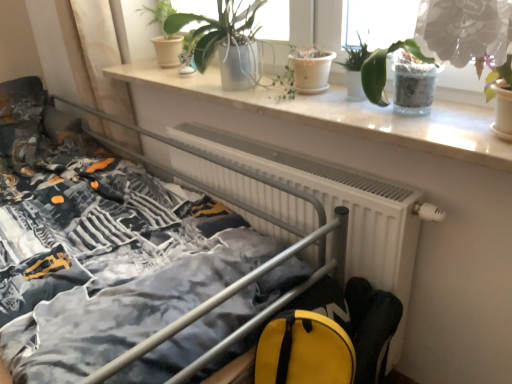
Question: Is metallic gray bed at center next to green glossy plant at upper right, which appears as the first houseplant when viewed from the right, and touching it?

Choices:
 (A) yes
 (B) no

Answer: (B)

Question: Is metallic gray bed at center to the right of green glossy plant at upper right, which appears as the fifth houseplant when viewed from the left, from the viewer's perspective?

Choices:
 (A) yes
 (B) no

Answer: (B)

Question: Does metallic gray bed at center have a greater width compared to green glossy plant at upper right, which appears as the fifth houseplant when viewed from the left?

Choices:
 (A) yes
 (B) no

Answer: (A)

Question: From a real-world perspective, is metallic gray bed at center positioned under green glossy plant at upper right, which appears as the fifth houseplant when viewed from the left, based on gravity?

Choices:
 (A) yes
 (B) no

Answer: (A)

Question: Can we say metallic gray bed at center lies outside green glossy plant at upper right, which appears as the fifth houseplant when viewed from the left?

Choices:
 (A) no
 (B) yes

Answer: (B)

Question: Is point (501, 104) positioned closer to the camera than point (61, 279)?

Choices:
 (A) closer
 (B) farther

Answer: (A)

Question: From a real-world perspective, is green glossy plant at upper right, which appears as the fifth houseplant when viewed from the left, physically located above or below metallic gray bed at center?

Choices:
 (A) above
 (B) below

Answer: (A)

Question: Considering the positions of green glossy plant at upper right, which appears as the first houseplant when viewed from the right, and metallic gray bed at center in the image, is green glossy plant at upper right, which appears as the first houseplant when viewed from the right, wider or thinner than metallic gray bed at center?

Choices:
 (A) thin
 (B) wide

Answer: (A)

Question: In terms of height, does green glossy plant at upper right, which appears as the fifth houseplant when viewed from the left, look taller or shorter compared to metallic gray bed at center?

Choices:
 (A) tall
 (B) short

Answer: (B)

Question: Does point (329, 92) appear closer or farther from the camera than point (249, 152)?

Choices:
 (A) farther
 (B) closer

Answer: (B)

Question: In the image, is white marble window sill at upper center positioned in front of or behind white matte radiator at center?

Choices:
 (A) front
 (B) behind

Answer: (A)

Question: Based on their sizes in the image, would you say white marble window sill at upper center is bigger or smaller than white matte radiator at center?

Choices:
 (A) big
 (B) small

Answer: (B)

Question: Is white marble window sill at upper center wider or thinner than white matte radiator at center?

Choices:
 (A) wide
 (B) thin

Answer: (A)

Question: Which is correct: translucent glass pot at upper right, arranged as the fourth houseplant when viewed from the left, is inside green matte plant at upper center, which ranks as the 5th houseplant in right-to-left order, or outside of it?

Choices:
 (A) outside
 (B) inside

Answer: (A)

Question: In terms of width, does translucent glass pot at upper right, arranged as the second houseplant when viewed from the right, look wider or thinner when compared to green matte plant at upper center, acting as the first houseplant starting from the left?

Choices:
 (A) wide
 (B) thin

Answer: (B)